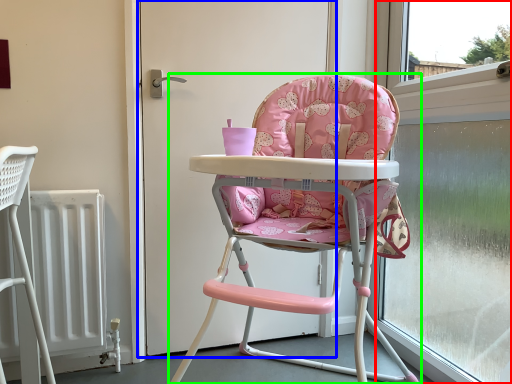
Question: Which object is the farthest from window screen (highlighted by a red box)? Choose among these: screen door (highlighted by a blue box) or chair (highlighted by a green box).

Choices:
 (A) screen door
 (B) chair

Answer: (A)